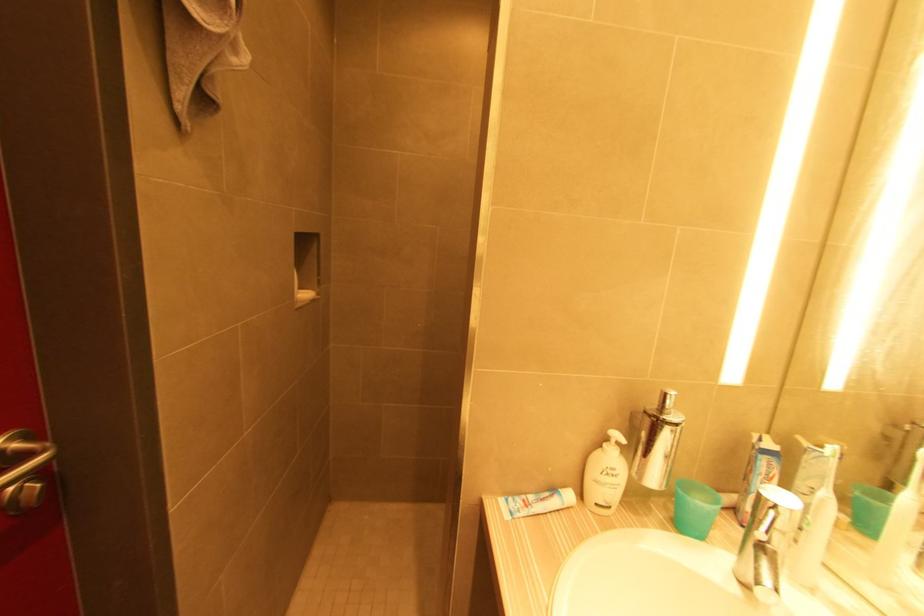
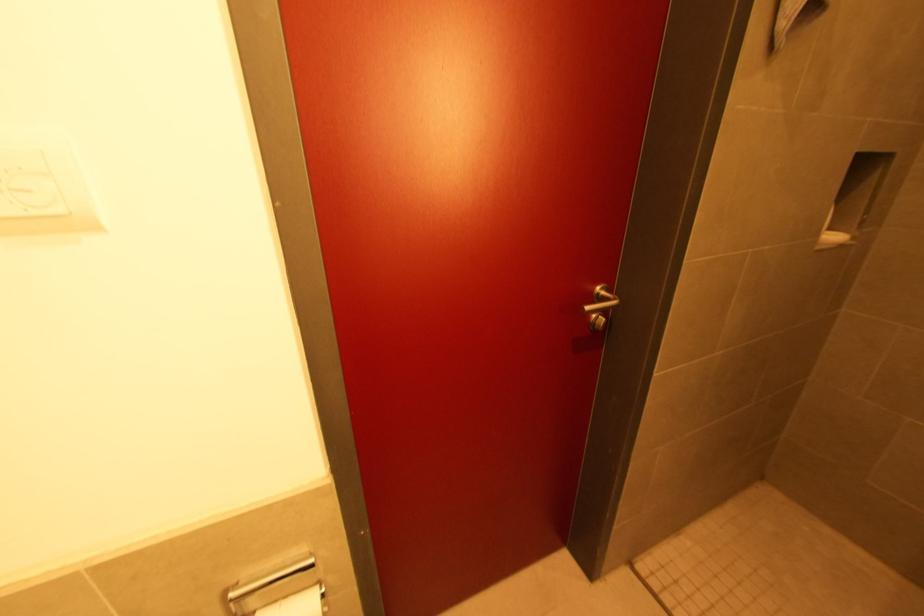
Question: The camera is either moving clockwise (left) or counter-clockwise (right) around the object. The first image is from the beginning of the video and the second image is from the end. Is the camera moving left or right when shooting the video?

Choices:
 (A) Left
 (B) Right

Answer: (B)